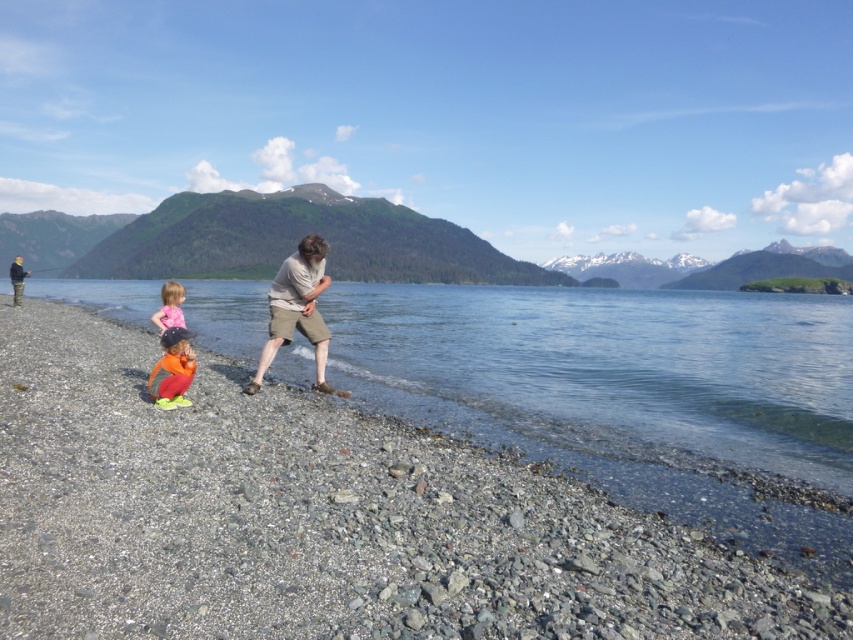
Looking at this image, you are standing at the edge of the lake and notice the smooth gravel beach at center and the orange fleece pants at lower left. Which object is closer to your current position?

The smooth gravel beach at center is closer to your current position because it is located below the orange fleece pants at lower left, indicating it is nearer to the viewer.

You are a photographer standing at the lakeside. You need to capture a photo of the orange fleece pants at lower left and the pink fabric toddler at lower left. Which object is narrower in width when viewed from your position?

The orange fleece pants at lower left is thinner than the pink fabric toddler at lower left, so it is narrower in width.